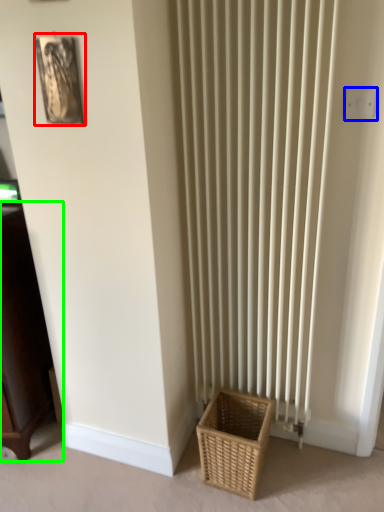
Question: Which object is positioned farthest from picture frame (highlighted by a red box)? Select from electric outlet (highlighted by a blue box) and furniture (highlighted by a green box).

Choices:
 (A) electric outlet
 (B) furniture

Answer: (A)